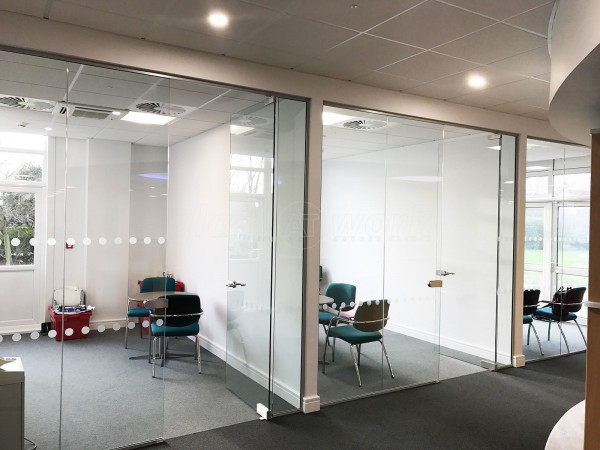
Image resolution: width=600 pixels, height=450 pixels. I want to click on ceiling vent, so click(368, 124), click(160, 104), click(21, 100).